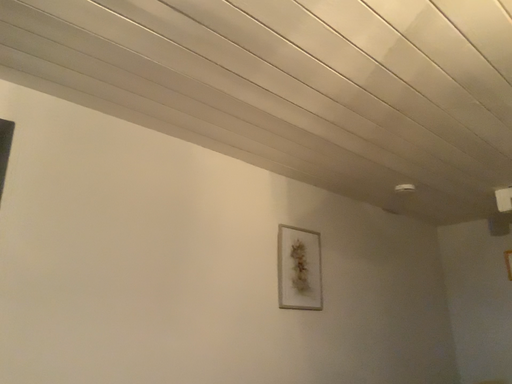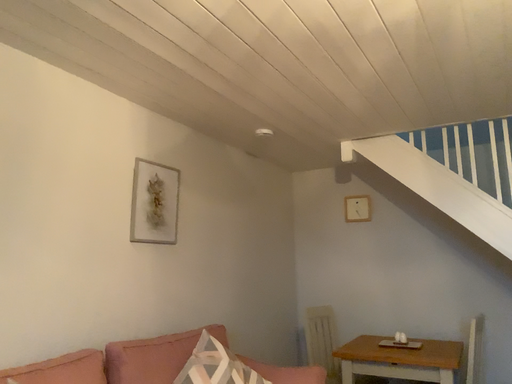
Question: How did the camera likely rotate when shooting the video?

Choices:
 (A) rotated right
 (B) rotated left

Answer: (A)